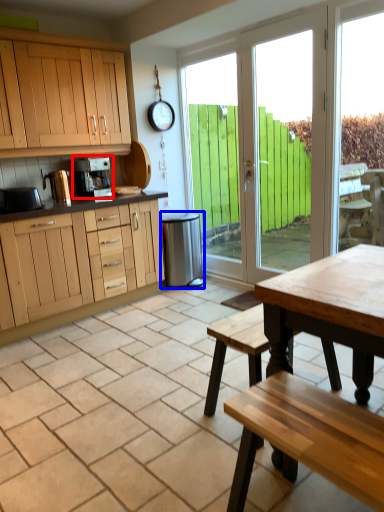
Question: Which object is further to the camera taking this photo, coffee maker (highlighted by a red box) or appliance (highlighted by a blue box)?

Choices:
 (A) coffee maker
 (B) appliance

Answer: (B)